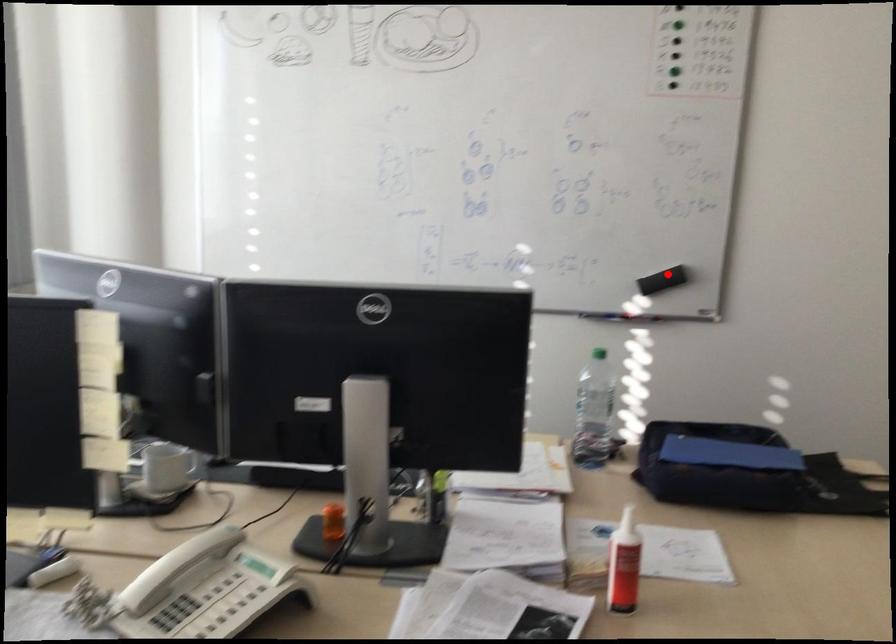
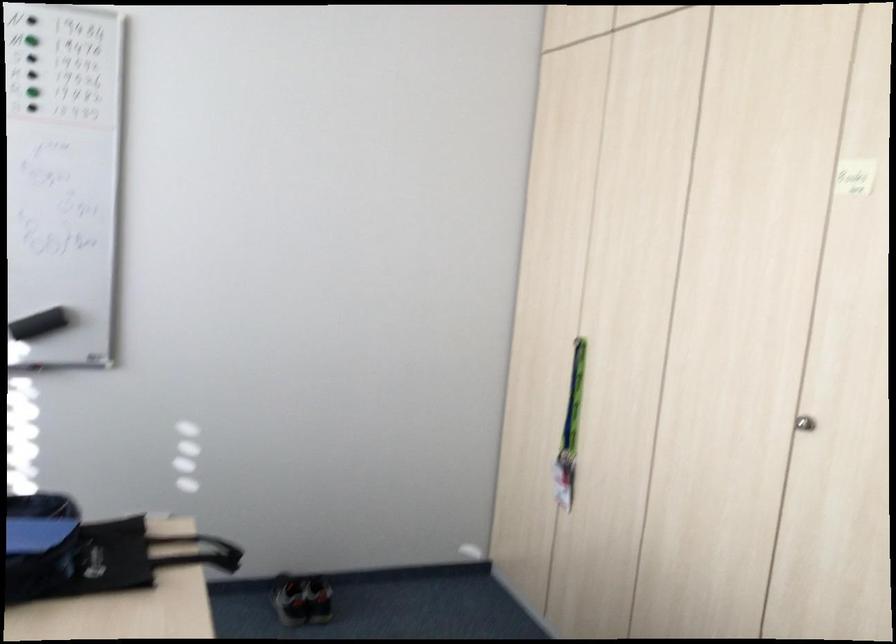
Question: I am providing you with two images of the same scene from different viewpoints. A red point is shown in image1. For the corresponding object point in image2, is it positioned nearer or farther from the camera?

Choices:
 (A) Nearer
 (B) Farther

Answer: (A)